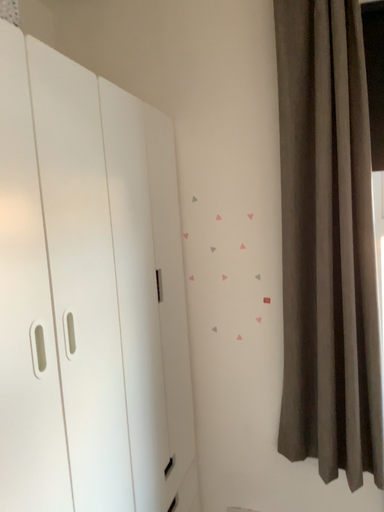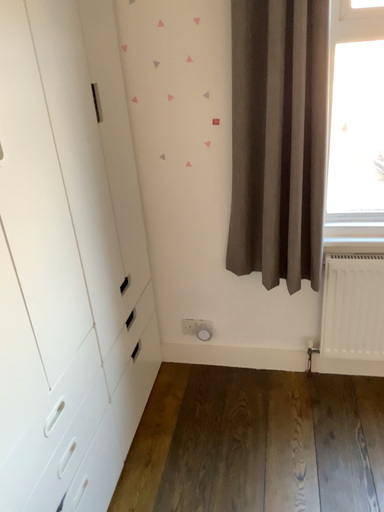
Question: Which way did the camera rotate in the video?

Choices:
 (A) rotated upward
 (B) rotated downward

Answer: (B)